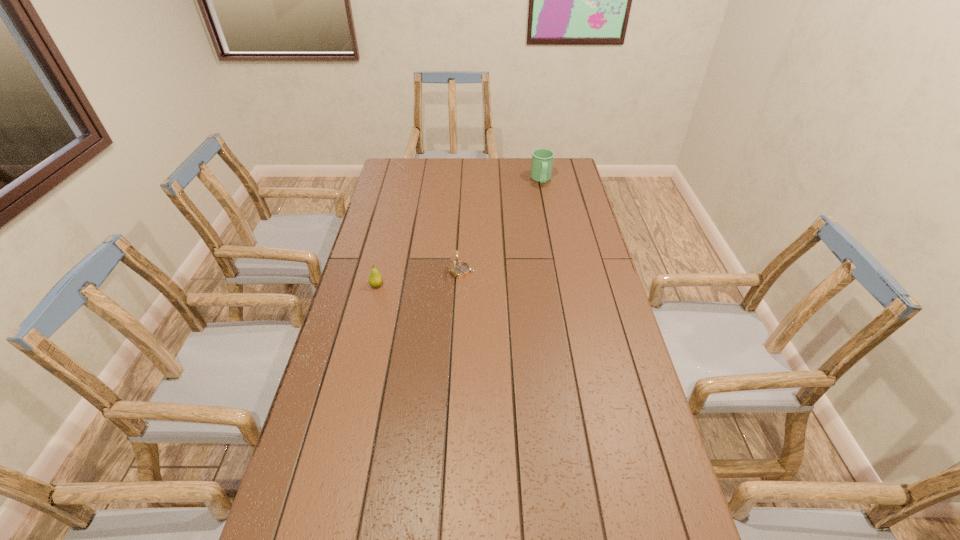
Where is `the tallest object`? This screenshot has height=540, width=960. the tallest object is located at coordinates (542, 159).

In order to click on the farthest object in this screenshot , I will do `click(542, 159)`.

Where is `the nearest object`? The image size is (960, 540). the nearest object is located at coordinates (375, 279).

Find the location of `the leftmost object`. the leftmost object is located at coordinates (375, 279).

Locate an element on the screen. The width and height of the screenshot is (960, 540). compass is located at coordinates (460, 269).

You are a GUI agent. You are given a task and a screenshot of the screen. Output one action in this format:
    pyautogui.click(x=<x>, y=<y>)
    Task: Click on the second object from left to right
    The height and width of the screenshot is (540, 960).
    Given the screenshot: What is the action you would take?
    pyautogui.click(x=460, y=269)

Find the location of a particular element. free space located on the side of the rightmost object with the handle is located at coordinates (547, 209).

Find the location of `free space located 0.140m on the back of the nearest object`. free space located 0.140m on the back of the nearest object is located at coordinates (385, 254).

Identify the location of free space located with the dial facing the second object from left to right. Image resolution: width=960 pixels, height=540 pixels. (547, 272).

I want to click on object present at the far edge, so click(x=542, y=159).